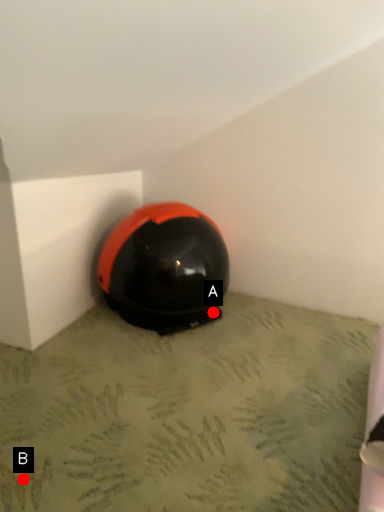
Question: Two points are circled on the image, labeled by A and B beside each circle. Which point is farther to the camera?

Choices:
 (A) A is further
 (B) B is further

Answer: (A)